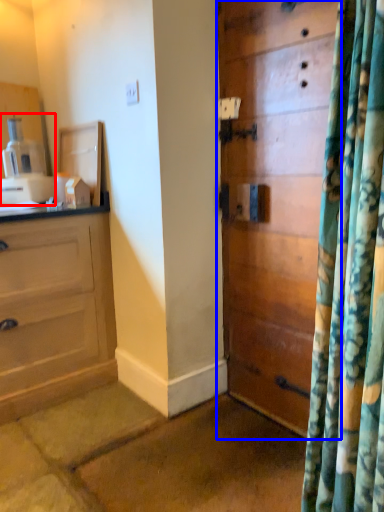
Question: Among these objects, which one is nearest to the camera, coffee machine (highlighted by a red box) or door (highlighted by a blue box)?

Choices:
 (A) coffee machine
 (B) door

Answer: (B)